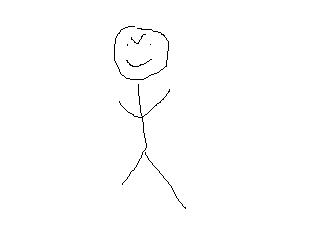
Find the location of `chest`. chest is located at coordinates (139, 106).